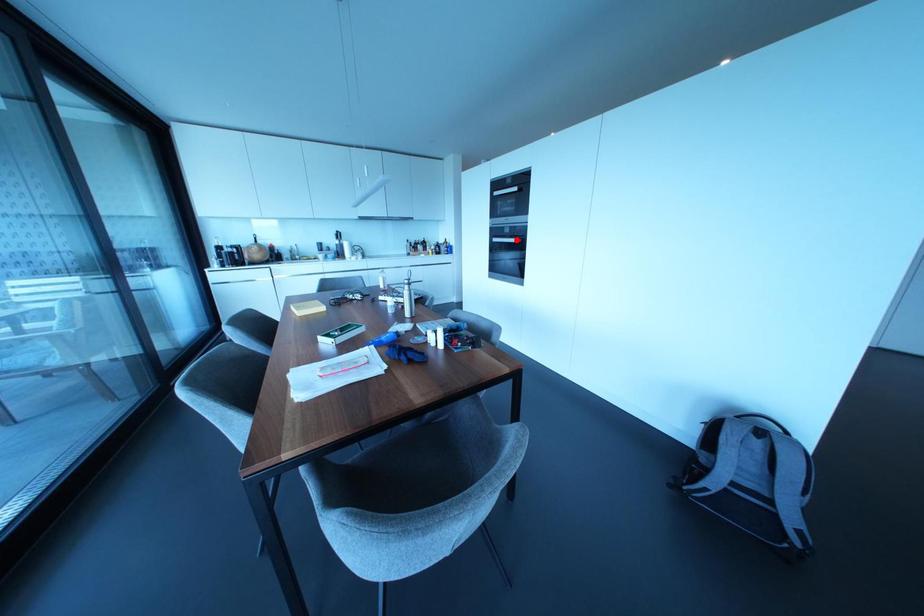
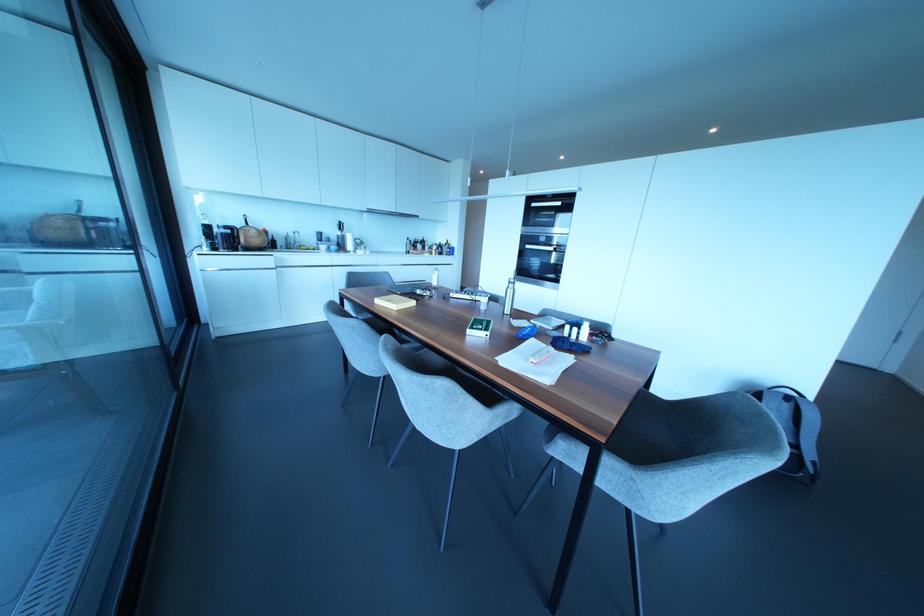
Locate, in the second image, the point that corresponds to the highlighted location in the first image.

(553, 248)